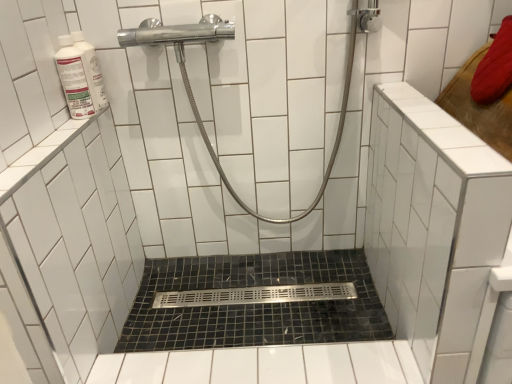
Question: Is black mosaic tile bath at center to the right of white glossy bottle at upper left from the viewer's perspective?

Choices:
 (A) no
 (B) yes

Answer: (B)

Question: Does black mosaic tile bath at center have a smaller size compared to white glossy bottle at upper left?

Choices:
 (A) yes
 (B) no

Answer: (B)

Question: Considering the relative positions of black mosaic tile bath at center and white glossy bottle at upper left in the image provided, is black mosaic tile bath at center behind white glossy bottle at upper left?

Choices:
 (A) no
 (B) yes

Answer: (B)

Question: Can you confirm if black mosaic tile bath at center is shorter than white glossy bottle at upper left?

Choices:
 (A) no
 (B) yes

Answer: (B)

Question: From a real-world perspective, is black mosaic tile bath at center below white glossy bottle at upper left?

Choices:
 (A) no
 (B) yes

Answer: (B)

Question: From a real-world perspective, is polished chrome showerhead at upper center above or below black mosaic tile bath at center?

Choices:
 (A) above
 (B) below

Answer: (A)

Question: Relative to black mosaic tile bath at center, is polished chrome showerhead at upper center in front or behind?

Choices:
 (A) behind
 (B) front

Answer: (B)

Question: Is polished chrome showerhead at upper center taller or shorter than black mosaic tile bath at center?

Choices:
 (A) short
 (B) tall

Answer: (B)

Question: Would you say polished chrome showerhead at upper center is inside or outside black mosaic tile bath at center?

Choices:
 (A) inside
 (B) outside

Answer: (B)

Question: Considering the positions of black mosaic tile bath at center and polished chrome showerhead at upper center in the image, is black mosaic tile bath at center taller or shorter than polished chrome showerhead at upper center?

Choices:
 (A) tall
 (B) short

Answer: (B)

Question: Is black mosaic tile bath at center in front of or behind polished chrome showerhead at upper center in the image?

Choices:
 (A) front
 (B) behind

Answer: (B)

Question: Is point (330, 324) positioned closer to the camera than point (231, 29)?

Choices:
 (A) closer
 (B) farther

Answer: (B)

Question: In terms of width, does black mosaic tile bath at center look wider or thinner when compared to polished chrome showerhead at upper center?

Choices:
 (A) thin
 (B) wide

Answer: (B)

Question: Relative to polished chrome showerhead at upper center, is white glossy bottle at upper left in front or behind?

Choices:
 (A) behind
 (B) front

Answer: (A)

Question: Is white glossy bottle at upper left spatially inside polished chrome showerhead at upper center, or outside of it?

Choices:
 (A) outside
 (B) inside

Answer: (A)